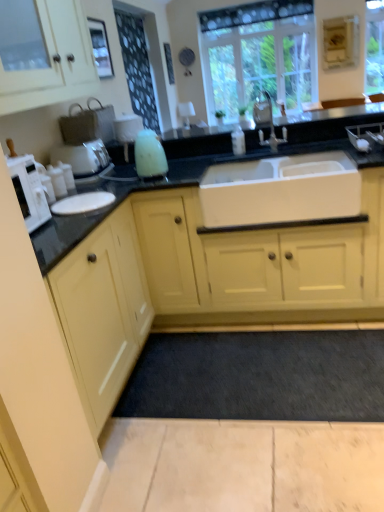
Question: From a real-world perspective, is silver metallic faucet at center physically above white matte microwave at left?

Choices:
 (A) yes
 (B) no

Answer: (B)

Question: Is silver metallic faucet at center smaller than white matte microwave at left?

Choices:
 (A) no
 (B) yes

Answer: (A)

Question: Is white matte microwave at left surrounded by silver metallic faucet at center?

Choices:
 (A) yes
 (B) no

Answer: (B)

Question: Can we say silver metallic faucet at center lies outside white matte microwave at left?

Choices:
 (A) yes
 (B) no

Answer: (A)

Question: Could you tell me if silver metallic faucet at center is facing white matte microwave at left?

Choices:
 (A) yes
 (B) no

Answer: (B)

Question: Does silver metallic faucet at center lie in front of white matte microwave at left?

Choices:
 (A) no
 (B) yes

Answer: (A)

Question: Would you say black granite countertop at center is a long distance from dark gray carpet at lower center?

Choices:
 (A) no
 (B) yes

Answer: (A)

Question: Is black granite countertop at center next to dark gray carpet at lower center and touching it?

Choices:
 (A) no
 (B) yes

Answer: (A)

Question: Is the position of black granite countertop at center more distant than that of dark gray carpet at lower center?

Choices:
 (A) no
 (B) yes

Answer: (B)

Question: Considering the relative sizes of black granite countertop at center and dark gray carpet at lower center in the image provided, is black granite countertop at center smaller than dark gray carpet at lower center?

Choices:
 (A) yes
 (B) no

Answer: (B)

Question: Is black granite countertop at center at the left side of dark gray carpet at lower center?

Choices:
 (A) no
 (B) yes

Answer: (B)

Question: From the image's perspective, is black granite countertop at center over dark gray carpet at lower center?

Choices:
 (A) yes
 (B) no

Answer: (A)

Question: Considering the relative sizes of white matte sink at center and matte white coffee machine at left in the image provided, is white matte sink at center bigger than matte white coffee machine at left?

Choices:
 (A) yes
 (B) no

Answer: (A)